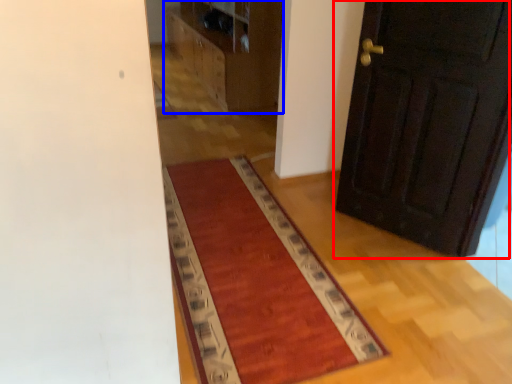
Question: Which point is further to the camera, door (highlighted by a red box) or dresser (highlighted by a blue box)?

Choices:
 (A) door
 (B) dresser

Answer: (B)